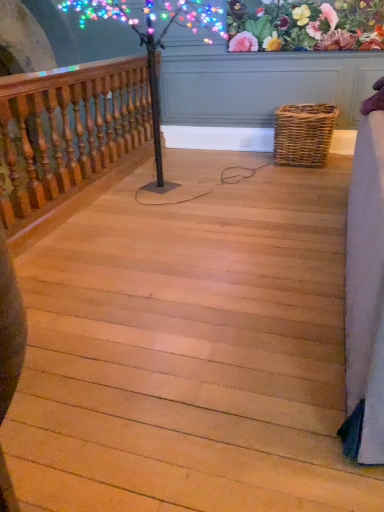
At what (x,y) coordinates should I click in order to perform the action: click on free space to the left of woven brown picnic basket at lower right. Please return your answer as a coordinate pair (x, y). Looking at the image, I should click on (249, 166).